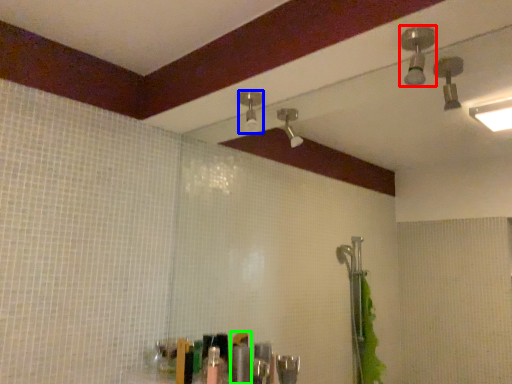
Question: Considering the real-world distances, which object is farthest from shower (highlighted by a red box)? shower (highlighted by a blue box) or toiletry (highlighted by a green box)?

Choices:
 (A) shower
 (B) toiletry

Answer: (B)